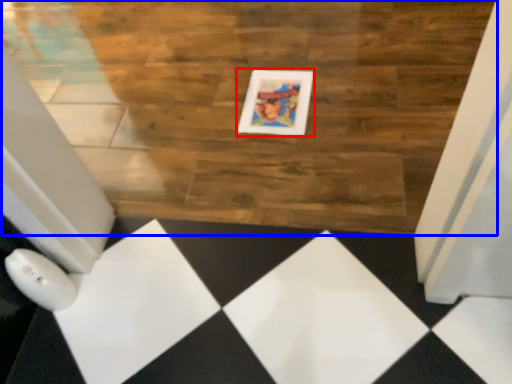
Question: Which of the following is the closest to the observer, picture frame (highlighted by a red box) or hardwood (highlighted by a blue box)?

Choices:
 (A) picture frame
 (B) hardwood

Answer: (B)